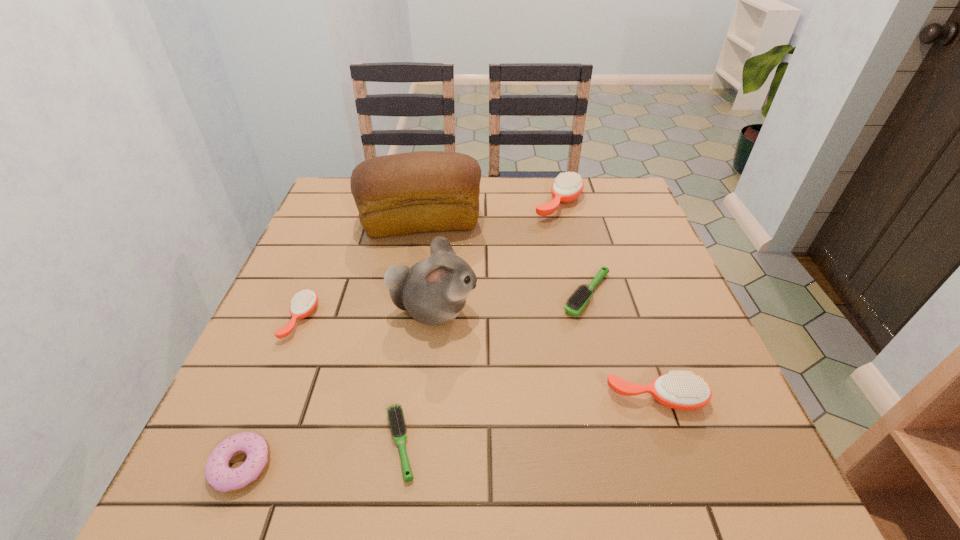
Locate an element on the screen. The width and height of the screenshot is (960, 540). the right light hairbrush is located at coordinates (575, 304).

Where is `the fourth tallest hairbrush`? This screenshot has width=960, height=540. the fourth tallest hairbrush is located at coordinates (575, 304).

Locate an element on the screen. pink doughnut is located at coordinates (218, 474).

Find the location of `the shortest object`. the shortest object is located at coordinates (395, 413).

Identify the location of the left light hairbrush. (395, 413).

You are a GUI agent. You are given a task and a screenshot of the screen. Output one action in this format:
    pyautogui.click(x=<x>, y=<y>)
    Task: Click on the free space located on the front of the tallest object
    
    Given the screenshot: What is the action you would take?
    [x=396, y=366]

This screenshot has width=960, height=540. Identify the location of free location located on the face of the white hamster. (618, 311).

Find the location of a particular element. This screenshot has width=960, height=540. vacant area located 0.150m on the right of the third tallest object is located at coordinates click(636, 203).

Find the location of a particular element. The height and width of the screenshot is (540, 960). vacant region located 0.210m on the back of the fourth tallest object is located at coordinates tap(624, 303).

What are the coordinates of `vacant space located 0.340m on the back of the second nearest orange hairbrush` in the screenshot? It's located at (344, 214).